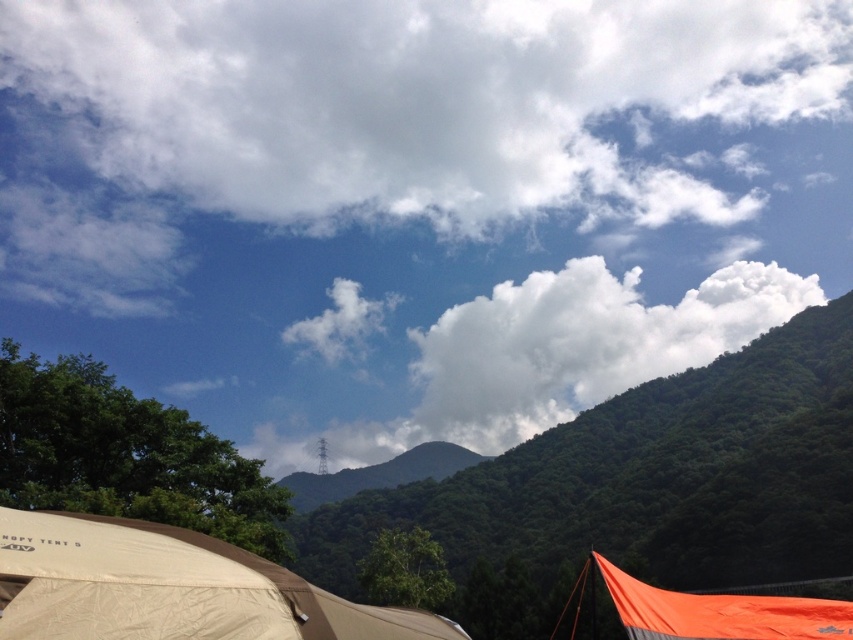
You are a hiker who wants to take a photo of the green leafy hillside at upper center and the white fluffy cloud at center. Which object is closer to the camera in the image?

The white fluffy cloud at center is closer to the camera because it is larger in size than the green leafy hillside at upper center, which has a lesser height compared to it.

You are planning to set up a picnic between the beige fabric tent at lower left and the orange fabric tent at lower right. The picnic blanket you have is 2 meters wide. Will there be enough space to spread it out between the two tents?

The distance between the beige fabric tent at lower left and the orange fabric tent at lower right is 25.53 meters, which is more than enough space to accommodate a 2 meter wide picnic blanket.

You are an outdoor enthusiast planning to set up a tent in the scene. You notice the green leafy hillside at upper center and the white fluffy cloud at center. Which of these two features is closer to you?

The green leafy hillside at upper center is closer to the viewer than the white fluffy cloud at center.